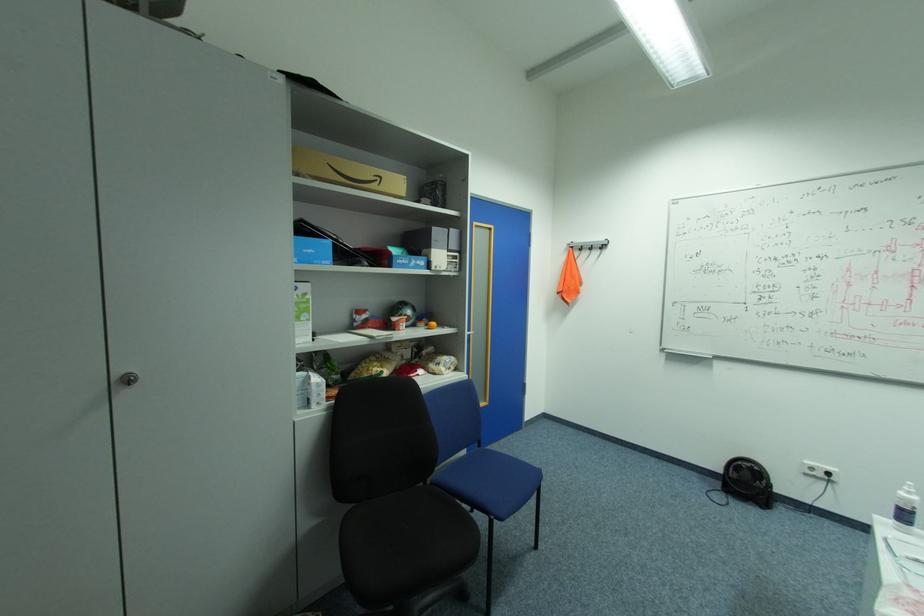
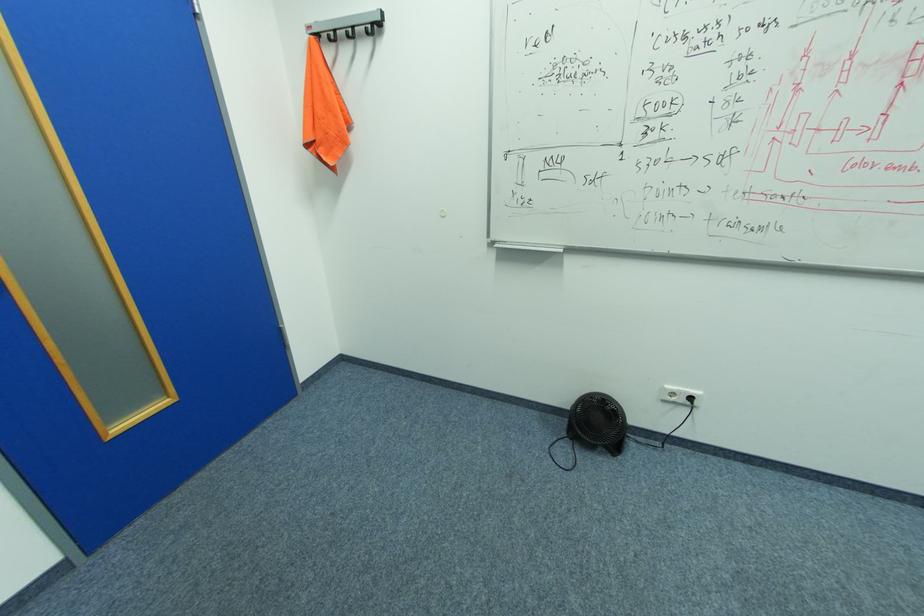
In the second image, find the point that corresponds to point (834, 474) in the first image.

(698, 399)